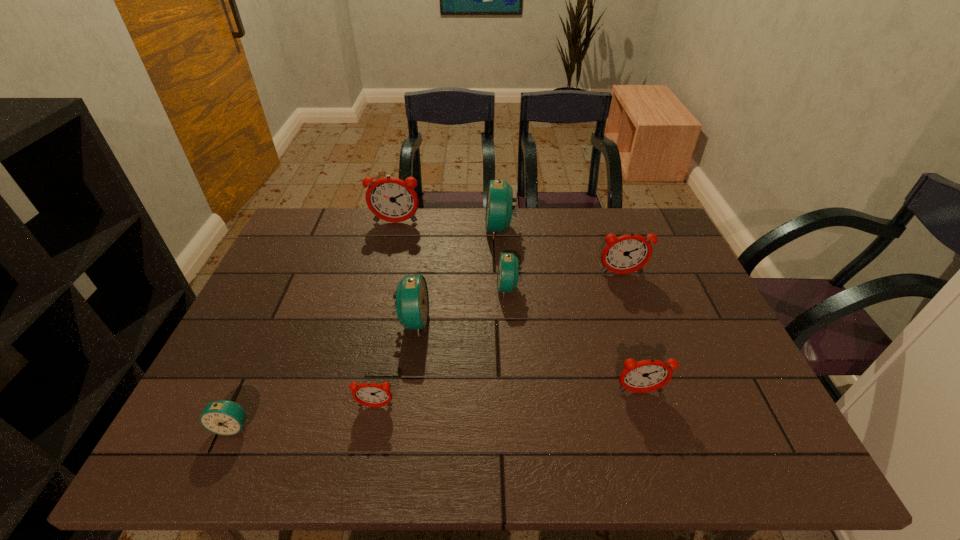
Where is `vacant space located 0.270m on the front-facing side of the third biggest blue alarm clock`? The height and width of the screenshot is (540, 960). vacant space located 0.270m on the front-facing side of the third biggest blue alarm clock is located at coordinates (402, 288).

Where is `vacant space located on the front-facing side of the sixth farthest alarm clock`? The height and width of the screenshot is (540, 960). vacant space located on the front-facing side of the sixth farthest alarm clock is located at coordinates (659, 453).

Where is `free space located 0.050m on the front-facing side of the nearest reddish-pink alarm clock`? The width and height of the screenshot is (960, 540). free space located 0.050m on the front-facing side of the nearest reddish-pink alarm clock is located at coordinates (371, 432).

The width and height of the screenshot is (960, 540). I want to click on object that is positioned at the near edge, so click(x=223, y=417).

Locate an element on the screen. Image resolution: width=960 pixels, height=540 pixels. object at the left edge is located at coordinates (223, 417).

The width and height of the screenshot is (960, 540). What are the coordinates of `object that is at the right edge` in the screenshot? It's located at (628, 253).

Image resolution: width=960 pixels, height=540 pixels. I want to click on object that is positioned at the near left corner, so click(x=223, y=417).

This screenshot has width=960, height=540. I want to click on free space at the far edge of the desktop, so click(379, 234).

Locate an element on the screen. vacant area at the near edge is located at coordinates (651, 443).

Locate an element on the screen. Image resolution: width=960 pixels, height=540 pixels. blank space at the left edge of the desktop is located at coordinates (284, 255).